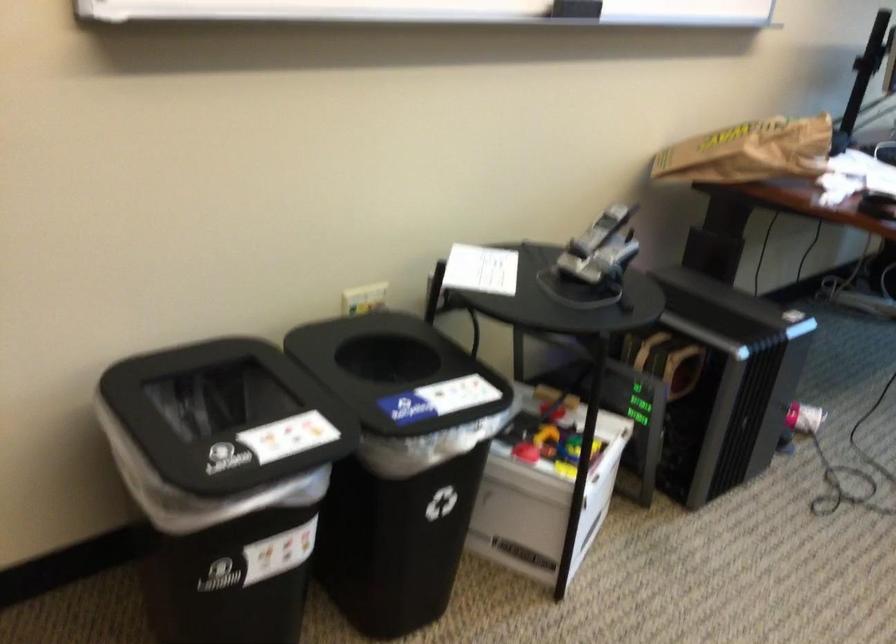
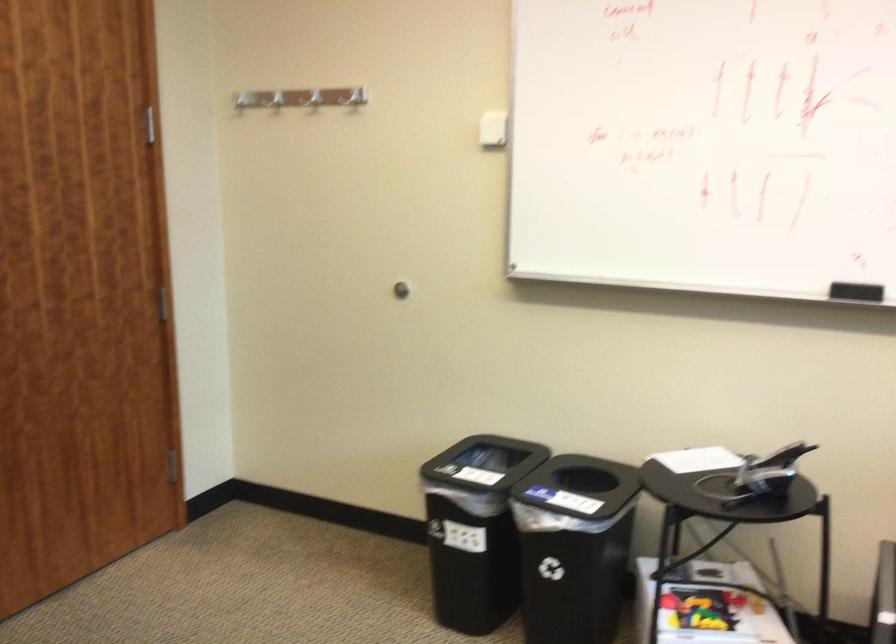
Locate, in the second image, the point that corresponds to (613,231) in the first image.

(782, 456)